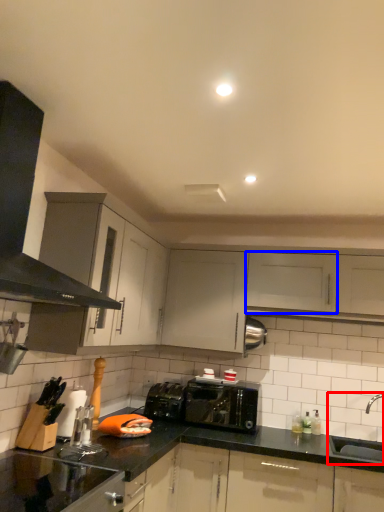
Question: Which object appears farthest to the camera in this image, sink (highlighted by a red box) or cabinetry (highlighted by a blue box)?

Choices:
 (A) sink
 (B) cabinetry

Answer: (B)